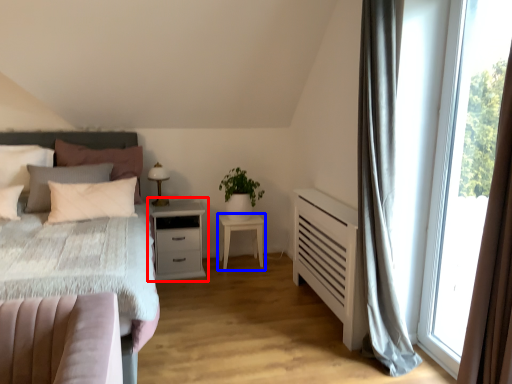
Question: Among these objects, which one is nearest to the camera, nightstand (highlighted by a red box) or nightstand (highlighted by a blue box)?

Choices:
 (A) nightstand
 (B) nightstand

Answer: (A)